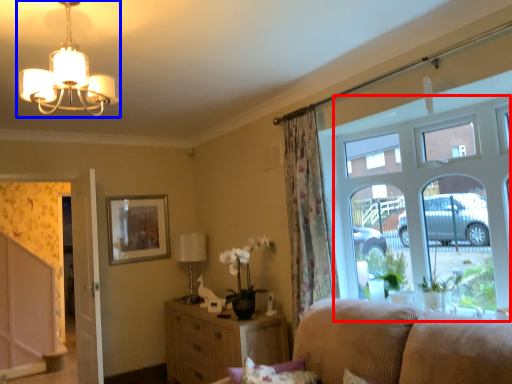
Question: Which of the following is the farthest to the observer, window (highlighted by a red box) or lamp (highlighted by a blue box)?

Choices:
 (A) window
 (B) lamp

Answer: (A)